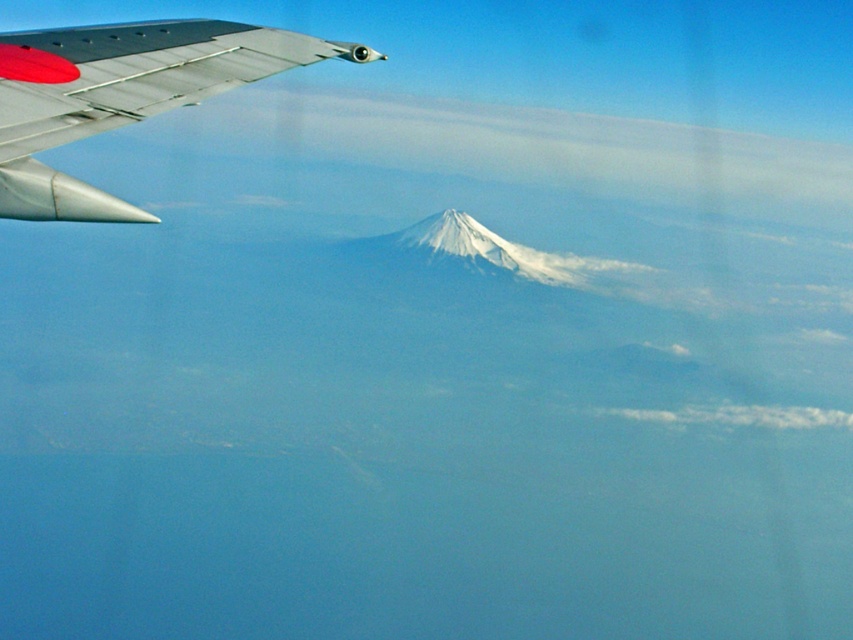
Which is more to the right, metallic silver winglet at upper left or white fluffy cloud at lower right?

white fluffy cloud at lower right is more to the right.

You are a GUI agent. You are given a task and a screenshot of the screen. Output one action in this format:
    pyautogui.click(x=<x>, y=<y>)
    Task: Click on the metallic silver winglet at upper left
    
    Given the screenshot: What is the action you would take?
    pyautogui.click(x=120, y=93)

Does point (134, 96) come behind point (839, 412)?

No, (134, 96) is closer to viewer.

Identify the location of metallic silver winglet at upper left. (120, 93).